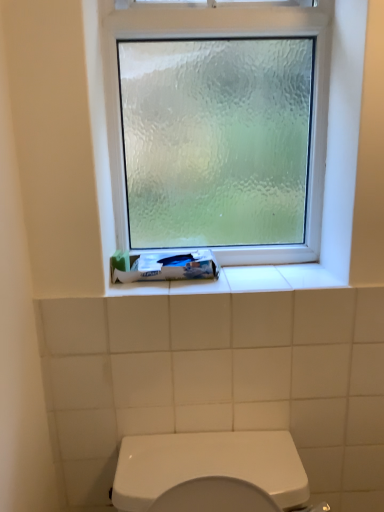
Question: Considering the relative positions of white matte tube at lower center and frosted glass window at upper center in the image provided, is white matte tube at lower center to the right of frosted glass window at upper center from the viewer's perspective?

Choices:
 (A) yes
 (B) no

Answer: (B)

Question: Does white matte tube at lower center lie behind frosted glass window at upper center?

Choices:
 (A) no
 (B) yes

Answer: (B)

Question: Can you confirm if white matte tube at lower center is wider than frosted glass window at upper center?

Choices:
 (A) no
 (B) yes

Answer: (B)

Question: From a real-world perspective, is white matte tube at lower center located beneath frosted glass window at upper center?

Choices:
 (A) no
 (B) yes

Answer: (B)

Question: Is white matte tube at lower center not within frosted glass window at upper center?

Choices:
 (A) no
 (B) yes

Answer: (B)

Question: Is white matte tube at lower center far from frosted glass window at upper center?

Choices:
 (A) no
 (B) yes

Answer: (A)

Question: From the image's perspective, is frosted glass window at upper center located above white matte tube at lower center?

Choices:
 (A) yes
 (B) no

Answer: (A)

Question: Does frosted glass window at upper center have a smaller size compared to white matte tube at lower center?

Choices:
 (A) no
 (B) yes

Answer: (A)

Question: From the image's perspective, is frosted glass window at upper center below white matte tube at lower center?

Choices:
 (A) yes
 (B) no

Answer: (B)

Question: Is frosted glass window at upper center not inside white matte tube at lower center?

Choices:
 (A) yes
 (B) no

Answer: (A)

Question: Can you confirm if frosted glass window at upper center is wider than white matte tube at lower center?

Choices:
 (A) yes
 (B) no

Answer: (B)

Question: From a real-world perspective, does frosted glass window at upper center stand above white matte tube at lower center?

Choices:
 (A) no
 (B) yes

Answer: (B)

Question: Considering the positions of white matte tube at lower center and frosted glass window at upper center in the image, is white matte tube at lower center bigger or smaller than frosted glass window at upper center?

Choices:
 (A) big
 (B) small

Answer: (B)